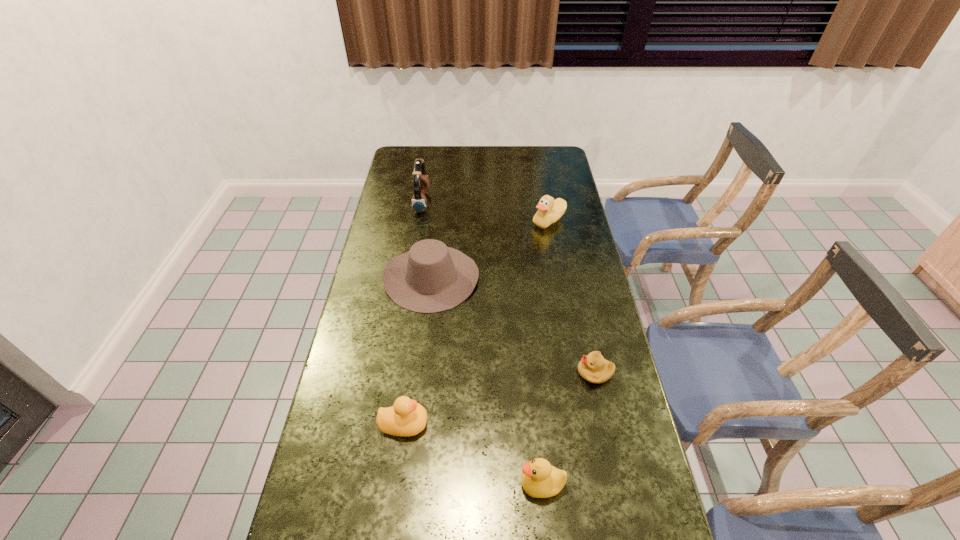
Identify the location of vacant space that's between the fourth farthest object and the third object from right to left. (568, 428).

The image size is (960, 540). I want to click on empty space between the tallest object and the leftmost duck, so click(x=413, y=313).

Identify the location of unoccupied area between the shortest object and the third object from right to left. This screenshot has height=540, width=960. (568, 428).

At what (x,y) coordinates should I click in order to perform the action: click on vacant point located between the rightmost duck and the fourth nearest object. Please return your answer as a coordinate pair (x, y). The height and width of the screenshot is (540, 960). Looking at the image, I should click on click(x=491, y=249).

This screenshot has height=540, width=960. Find the location of `free spot between the tallest object and the second farthest duck`. free spot between the tallest object and the second farthest duck is located at coordinates (413, 313).

Identify the location of vacant space that's between the second nearest object and the shortest object. (499, 398).

What are the coordinates of `free space between the tallest object and the third object from right to left` in the screenshot? It's located at (482, 343).

What are the coordinates of `vacant area that lies between the nearest object and the rightmost duck` in the screenshot? It's located at click(545, 353).

The image size is (960, 540). Find the location of `vacant point located between the nearest object and the leftmost duck`. vacant point located between the nearest object and the leftmost duck is located at coordinates (473, 454).

Locate which object ranks fourth in proximity to the third farthest object. Please provide its 2D coordinates. Your answer should be formatted as a tuple, i.e. [(x, y)], where the tuple contains the x and y coordinates of a point satisfying the conditions above.

[(406, 417)]